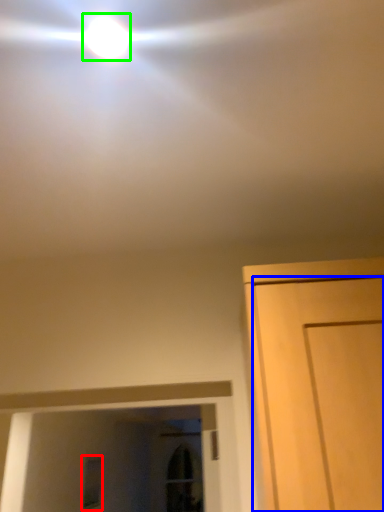
Question: Considering the real-world distances, which object is closest to window (highlighted by a red box)? door (highlighted by a blue box) or droplight (highlighted by a green box).

Choices:
 (A) door
 (B) droplight

Answer: (A)